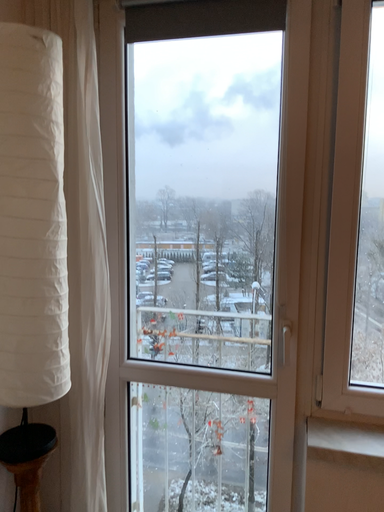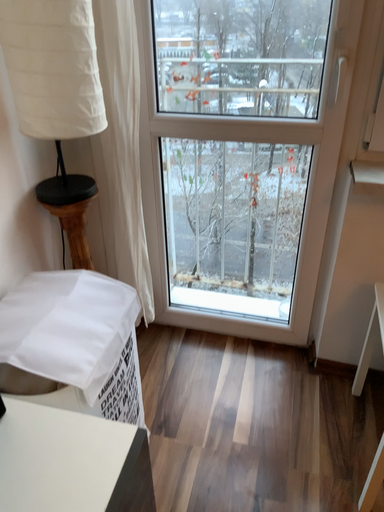
Question: How did the camera likely rotate when shooting the video?

Choices:
 (A) rotated downward
 (B) rotated upward

Answer: (A)